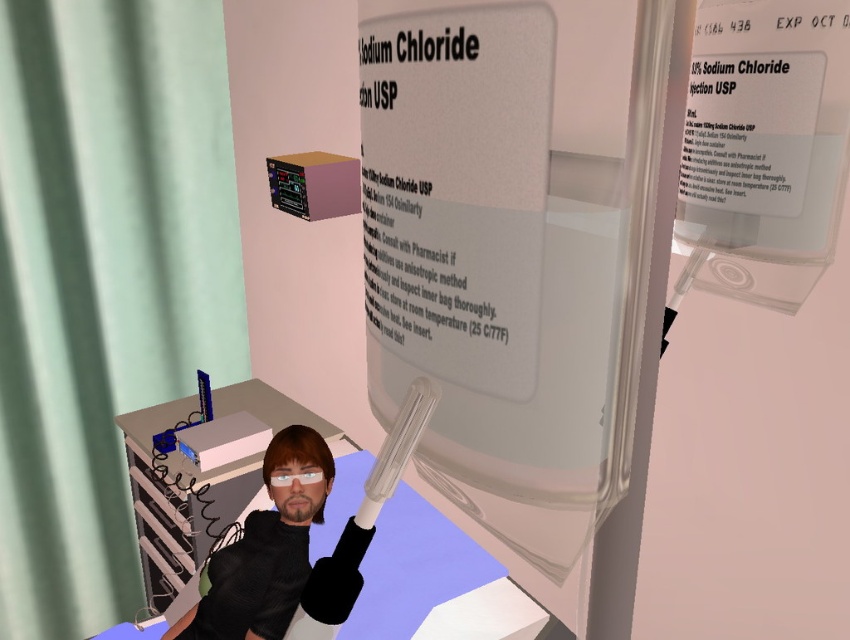
Is point (103, 51) positioned after point (303, 525)?

That is True.

Between light green fabric curtain at left and smooth black shirt at center, which one has more height?

light green fabric curtain at left is taller.

This screenshot has width=850, height=640. I want to click on light green fabric curtain at left, so click(103, 280).